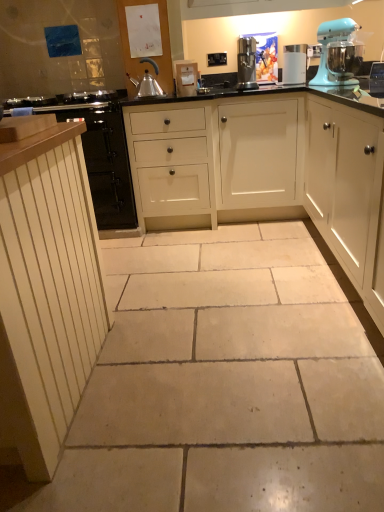
Question: Should I look upward or downward to see white wood cabinets at center, positioned as the 3th cabinetry in left-to-right order?

Choices:
 (A) up
 (B) down

Answer: (A)

Question: From a real-world perspective, is white glossy water filter at upper center, the 1th kitchen appliance viewed from the right, positioned under satin silver coffee maker at upper center, the first kitchen appliance when ordered from left to right, based on gravity?

Choices:
 (A) yes
 (B) no

Answer: (A)

Question: Is white glossy water filter at upper center, which appears as the second kitchen appliance when viewed from the left, at the left side of satin silver coffee maker at upper center, placed as the second kitchen appliance when sorted from right to left?

Choices:
 (A) yes
 (B) no

Answer: (B)

Question: Can you confirm if white glossy water filter at upper center, the 1th kitchen appliance viewed from the right, is wider than satin silver coffee maker at upper center, the first kitchen appliance when ordered from left to right?

Choices:
 (A) yes
 (B) no

Answer: (B)

Question: Would you say satin silver coffee maker at upper center, the first kitchen appliance when ordered from left to right, is part of white glossy water filter at upper center, the 1th kitchen appliance viewed from the right,'s contents?

Choices:
 (A) yes
 (B) no

Answer: (B)

Question: Is white glossy water filter at upper center, the 1th kitchen appliance viewed from the right, at the right side of satin silver coffee maker at upper center, placed as the second kitchen appliance when sorted from right to left?

Choices:
 (A) yes
 (B) no

Answer: (A)

Question: Is white glossy water filter at upper center, the 1th kitchen appliance viewed from the right, not within satin silver coffee maker at upper center, placed as the second kitchen appliance when sorted from right to left?

Choices:
 (A) yes
 (B) no

Answer: (A)

Question: Can you confirm if white wood cabinet at left, which is counted as the first cabinetry, starting from the left, is bigger than beige stone floor at center?

Choices:
 (A) yes
 (B) no

Answer: (A)

Question: Is white wood cabinet at left, which is counted as the first cabinetry, starting from the left, thinner than beige stone floor at center?

Choices:
 (A) no
 (B) yes

Answer: (B)

Question: Does white wood cabinet at left, which is counted as the first cabinetry, starting from the left, appear on the right side of beige stone floor at center?

Choices:
 (A) no
 (B) yes

Answer: (A)

Question: Is white wood cabinet at left, the fourth cabinetry viewed from the right, positioned with its back to beige stone floor at center?

Choices:
 (A) no
 (B) yes

Answer: (A)

Question: Can you confirm if white wood cabinet at left, which is counted as the first cabinetry, starting from the left, is smaller than beige stone floor at center?

Choices:
 (A) no
 (B) yes

Answer: (A)

Question: Is white wood cabinet at left, the fourth cabinetry viewed from the right, wider than beige stone floor at center?

Choices:
 (A) no
 (B) yes

Answer: (A)

Question: Considering the relative sizes of white wood cabinets at center, positioned as the 3th cabinetry in left-to-right order, and white wood cabinet at left, which is counted as the first cabinetry, starting from the left, in the image provided, is white wood cabinets at center, positioned as the 3th cabinetry in left-to-right order, thinner than white wood cabinet at left, which is counted as the first cabinetry, starting from the left,?

Choices:
 (A) no
 (B) yes

Answer: (B)